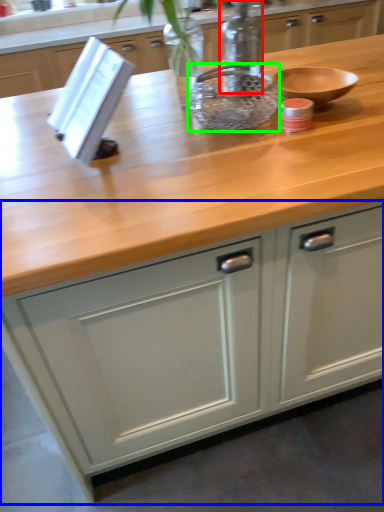
Question: Estimate the real-world distances between objects in this image. Which object is closer to bottle (highlighted by a red box), cabinetry (highlighted by a blue box) or bowl (highlighted by a green box)?

Choices:
 (A) cabinetry
 (B) bowl

Answer: (B)